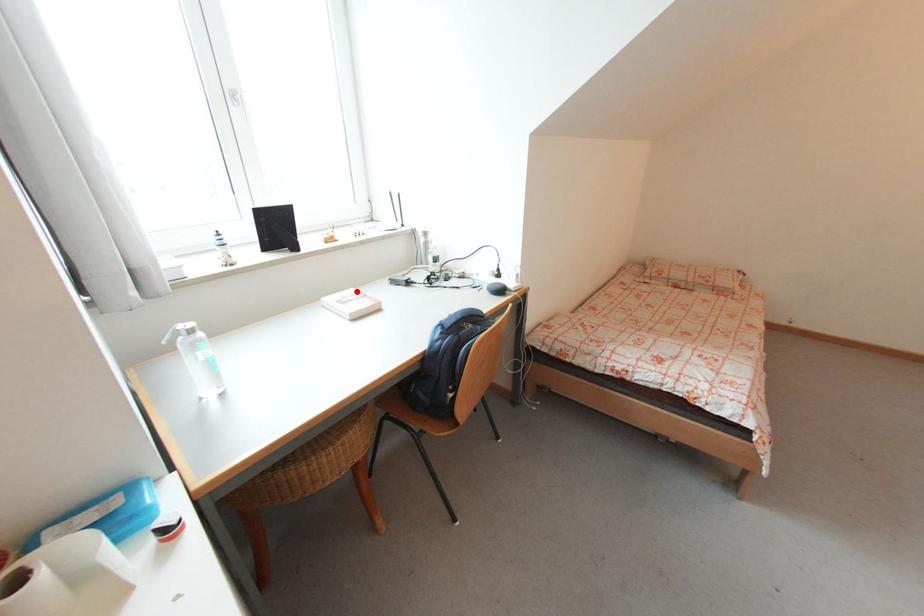
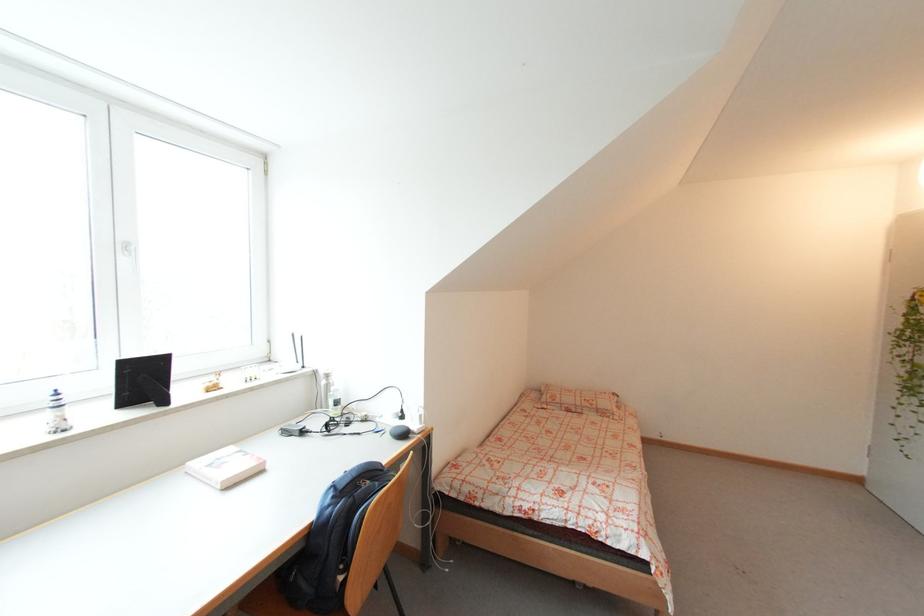
In the second image, find the point that corresponds to the highlighted location in the first image.

(236, 450)